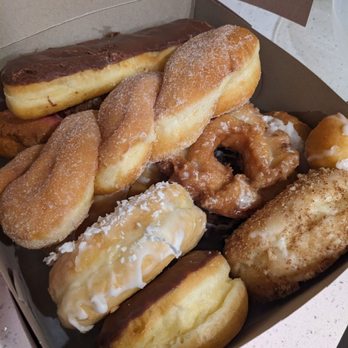
Identify the location of cardboard box. The width and height of the screenshot is (348, 348). (80, 32).